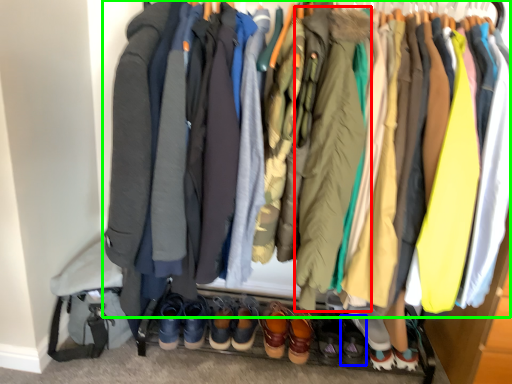
Question: Considering the real-world distances, which object is farthest from jacket (highlighted by a red box)? footwear (highlighted by a blue box) or jacket (highlighted by a green box)?

Choices:
 (A) footwear
 (B) jacket

Answer: (B)